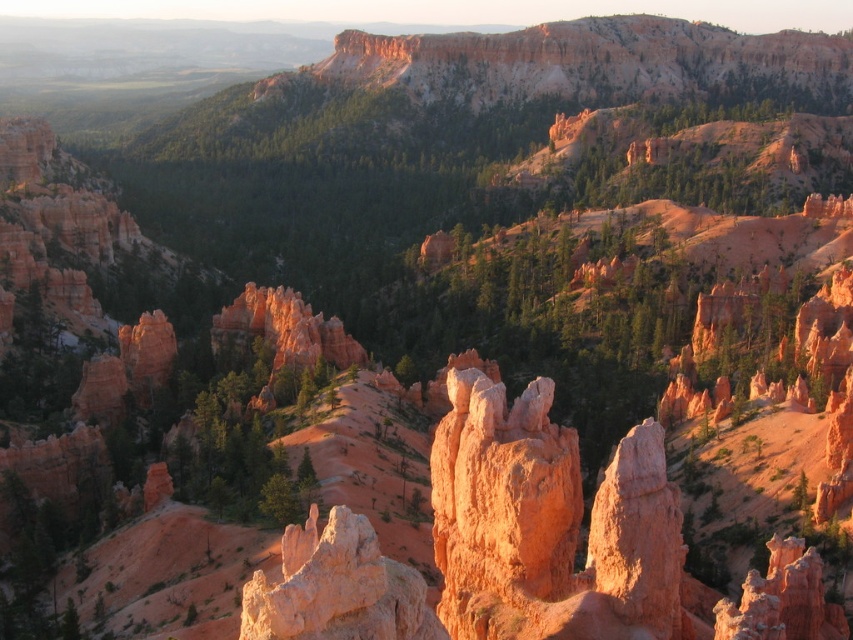
Question: Which object appears farthest from the camera in this image?

Choices:
 (A) rustic sandstone spire at center
 (B) rustic sandstone spires at center

Answer: (B)

Question: Is rustic sandstone spires at center wider than rustic sandstone spire at center?

Choices:
 (A) yes
 (B) no

Answer: (A)

Question: From the image, what is the correct spatial relationship of rustic sandstone spires at center in relation to rustic sandstone spire at center?

Choices:
 (A) left
 (B) right

Answer: (B)

Question: Which of the following is the farthest from the observer?

Choices:
 (A) rustic sandstone spires at center
 (B) rustic sandstone spire at center

Answer: (A)

Question: Among these points, which one is nearest to the camera?

Choices:
 (A) (247, 586)
 (B) (469, 556)

Answer: (A)

Question: Can you confirm if rustic sandstone spires at center is positioned to the right of rustic sandstone spire at center?

Choices:
 (A) yes
 (B) no

Answer: (A)